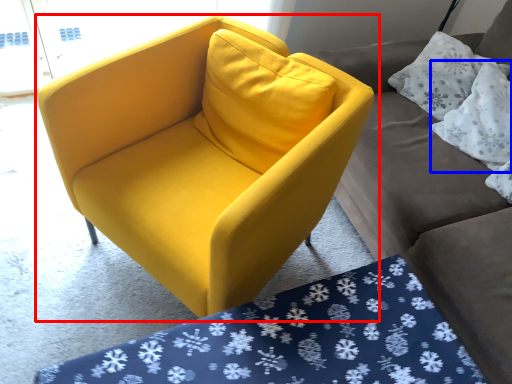
Question: Which point is further to the camera, chair (highlighted by a red box) or pillow (highlighted by a blue box)?

Choices:
 (A) chair
 (B) pillow

Answer: (B)